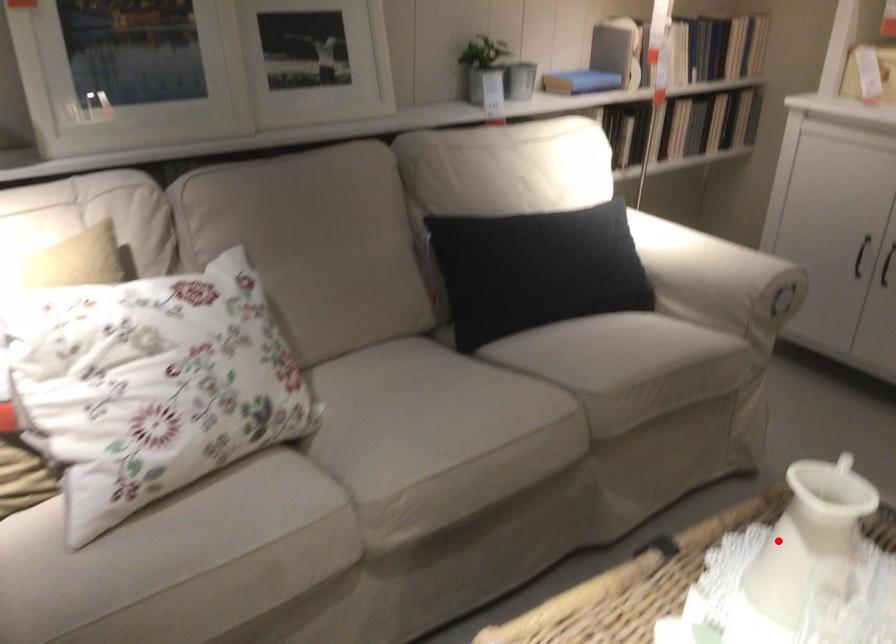
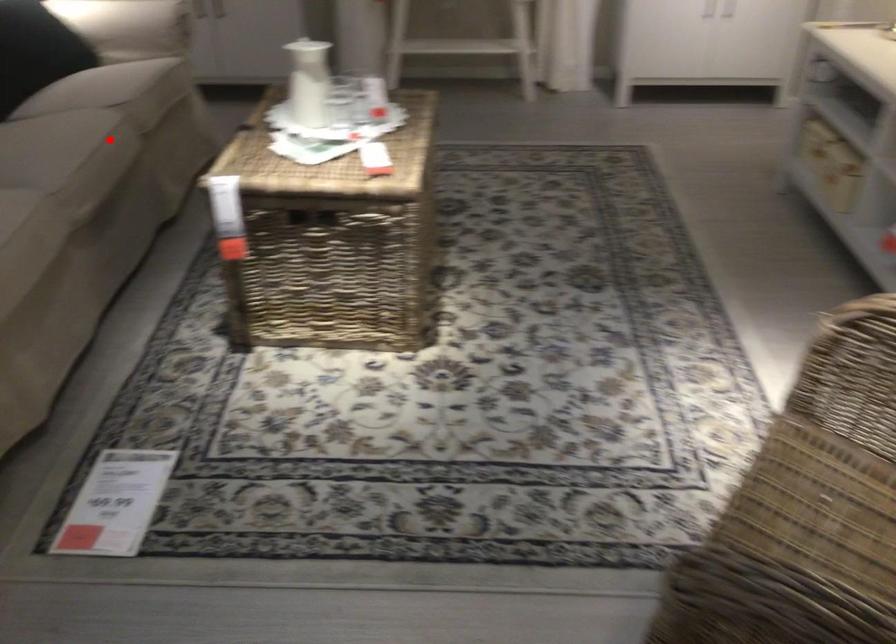
I am providing you with two images of the same scene from different viewpoints. A red point is marked on the first image and another point is marked on the second image. Is the red point in image1 aligned with the point shown in image2?

No